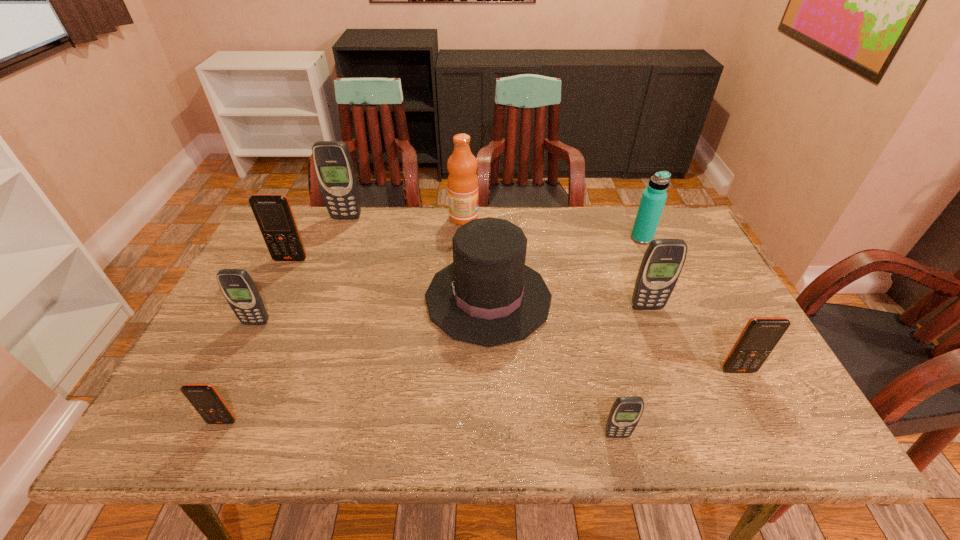
Find the location of `vacant space located 0.210m on the left of the water bottle`. vacant space located 0.210m on the left of the water bottle is located at coordinates (564, 238).

Find the location of a particular element. blank area located on the screen of the second farthest cellular telephone is located at coordinates (278, 286).

Identify the location of blank space located on the screen of the rightmost gray cellular telephone. Image resolution: width=960 pixels, height=540 pixels. (682, 400).

Where is `free space located on the front of the purple dress hat with the decoration`? The image size is (960, 540). free space located on the front of the purple dress hat with the decoration is located at coordinates (396, 298).

Locate an element on the screen. vacant space situated on the front of the purple dress hat with the decoration is located at coordinates (351, 298).

Identify the location of free space located 0.260m on the front of the purple dress hat with the decoration. (329, 298).

Where is `vacant space located on the screen of the fourth farthest cellular telephone`? vacant space located on the screen of the fourth farthest cellular telephone is located at coordinates (230, 375).

Identify the location of vacant area situated on the screen of the third nearest cellular telephone. (769, 430).

Where is `fruit juice present at the far edge`? This screenshot has width=960, height=540. fruit juice present at the far edge is located at coordinates (462, 165).

At what (x,y) coordinates should I click in order to perform the action: click on cellular telephone situated at the far edge. Please return your answer as a coordinate pair (x, y). The width and height of the screenshot is (960, 540). Looking at the image, I should click on 334,168.